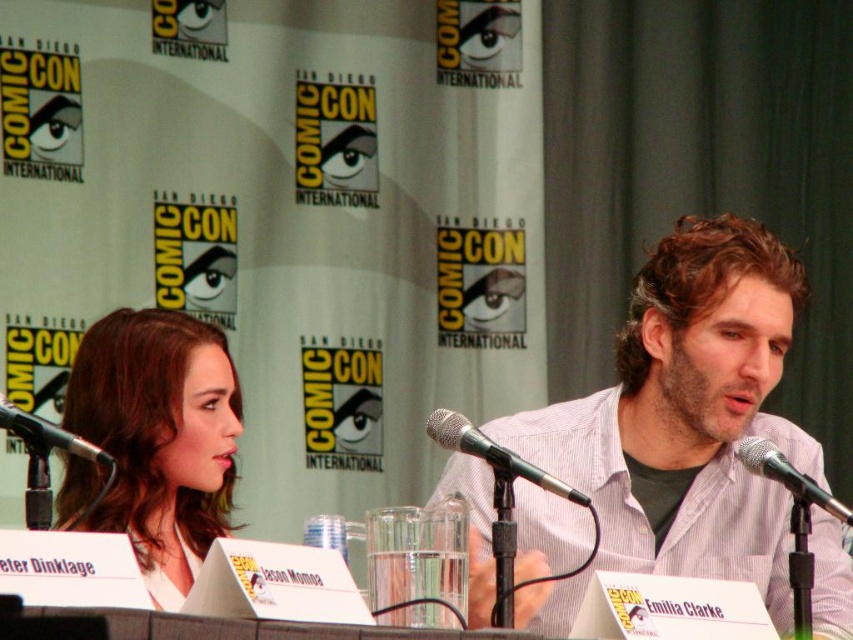
Is point (712, 305) less distant than point (746, 460)?

No.

Who is more forward, [755,548] or [750,451]?

Point [750,451]

Is point (582, 432) farther from camera compared to point (767, 470)?

Yes, point (582, 432) is farther from viewer.

In order to click on gray striped shirt at center in this screenshot , I will do `click(688, 413)`.

Is black metallic microphone at center shorter than metallic silver microphone at center?

Correct, black metallic microphone at center is not as tall as metallic silver microphone at center.

Is point (451, 426) positioned in front of point (813, 492)?

Yes, it is in front of point (813, 492).

This screenshot has height=640, width=853. What are the coordinates of `black metallic microphone at center` in the screenshot? It's located at (494, 452).

Who is positioned more to the right, smooth brown hair at center or black metallic microphone at center?

Positioned to the right is black metallic microphone at center.

Who is higher up, smooth brown hair at center or black metallic microphone at center?

Positioned higher is black metallic microphone at center.

What do you see at coordinates (160, 436) in the screenshot? The image size is (853, 640). I see `smooth brown hair at center` at bounding box center [160, 436].

Locate an element on the screen. The image size is (853, 640). smooth brown hair at center is located at coordinates click(160, 436).